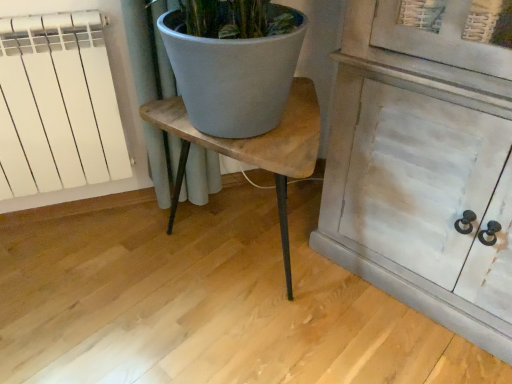
Where is `vacant region under wooden table at center (from a real-world perspective)`? The height and width of the screenshot is (384, 512). vacant region under wooden table at center (from a real-world perspective) is located at coordinates (232, 271).